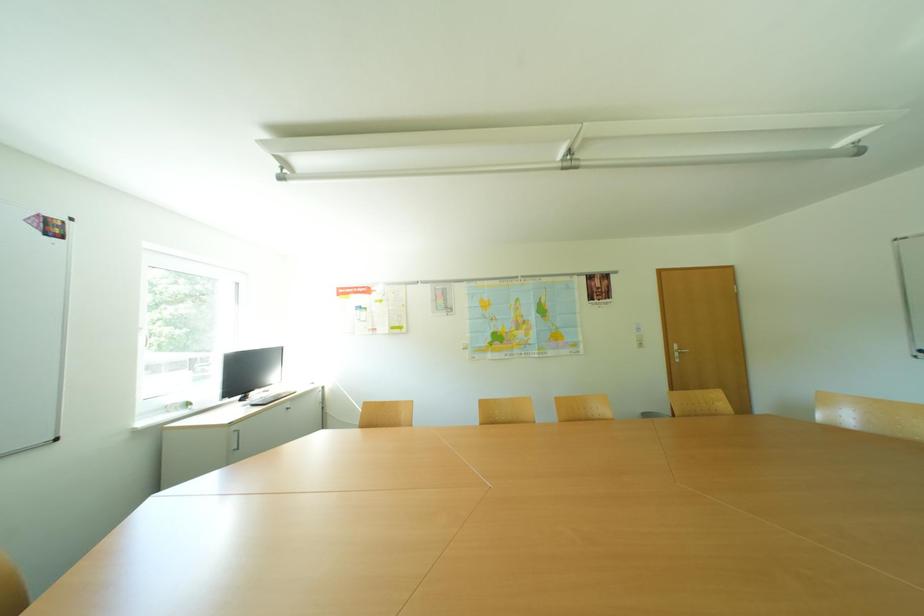
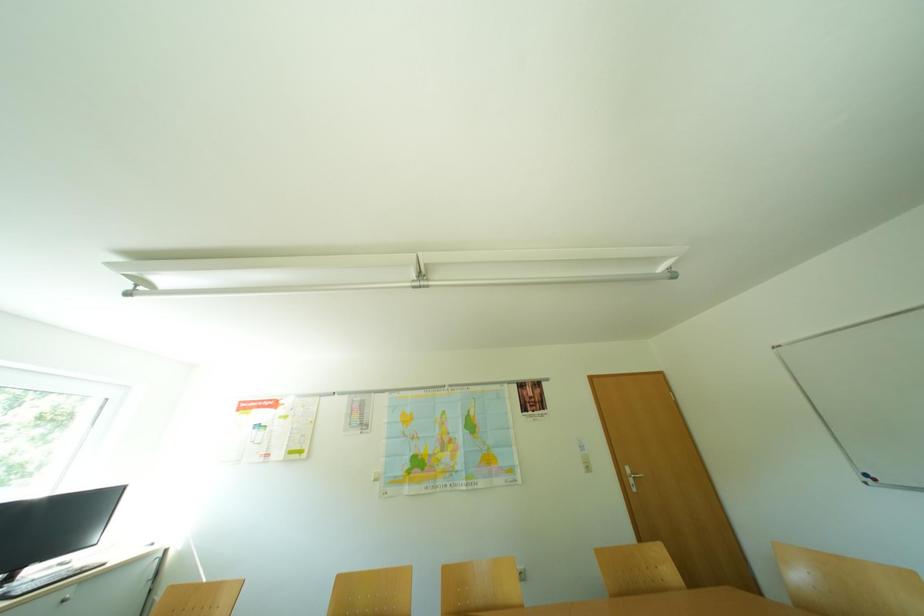
Question: Based on the continuous images, in which direction is the camera rotating? Reply with the corresponding letter.

Choices:
 (A) Left
 (B) Right
 (C) Up
 (D) Down

Answer: (C)